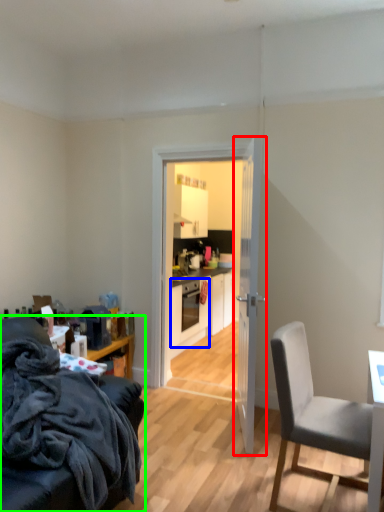
Question: Which object is positioned closest to door (highlighted by a red box)? Select from oven (highlighted by a blue box) and chair (highlighted by a green box).

Choices:
 (A) oven
 (B) chair

Answer: (B)